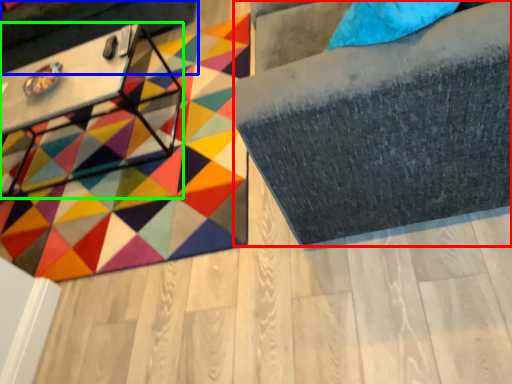
Question: Considering the real-world distances, which object is closest to furniture (highlighted by a red box)? swivel chair (highlighted by a blue box) or table (highlighted by a green box).

Choices:
 (A) swivel chair
 (B) table

Answer: (B)